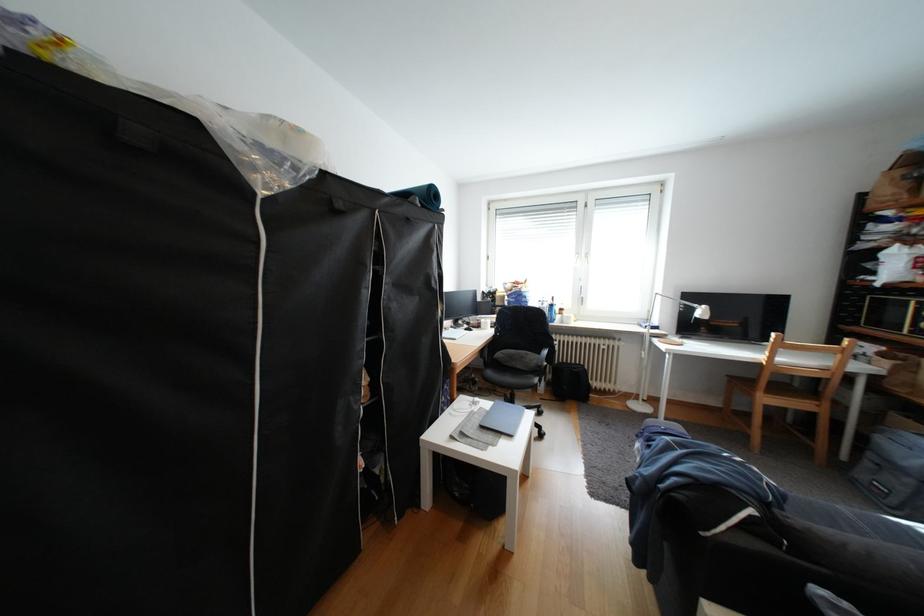
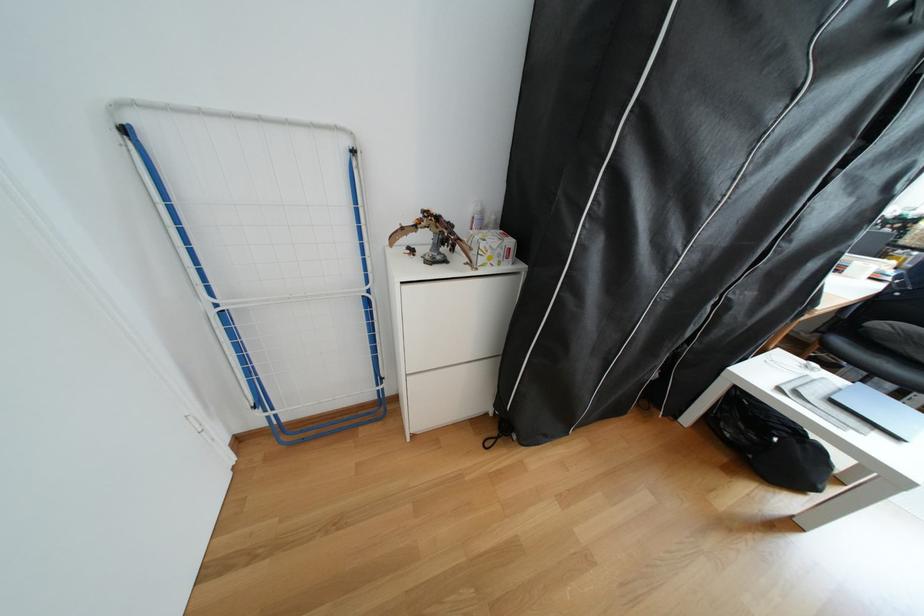
Find the pixel in the second image that matches point 512,355 in the first image.

(894, 326)